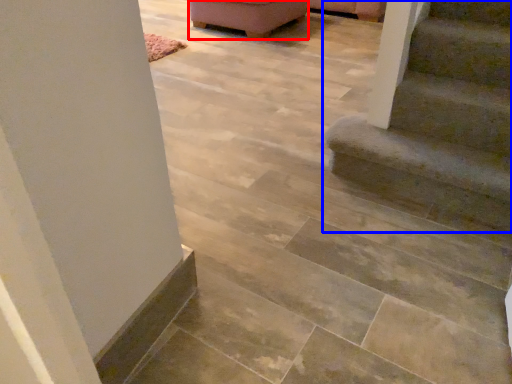
Question: Which of the following is the farthest to the observer, furniture (highlighted by a red box) or stairs (highlighted by a blue box)?

Choices:
 (A) furniture
 (B) stairs

Answer: (A)